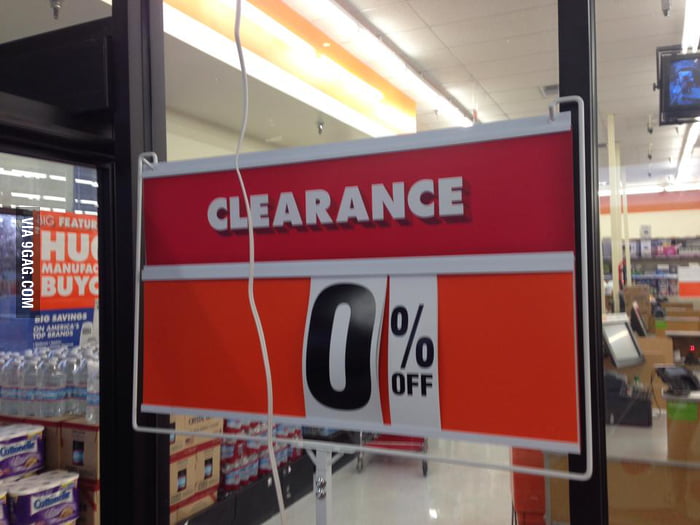
In order to click on window in this screenshot , I will do `click(670, 320)`, `click(469, 67)`.